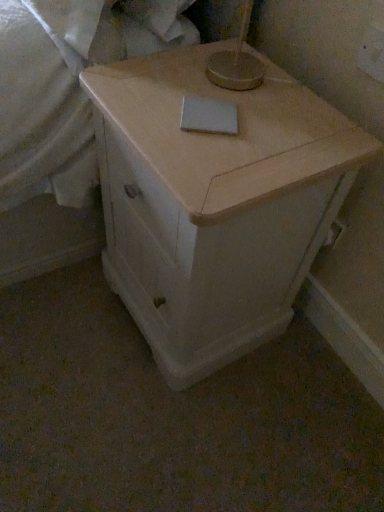
What do you see at coordinates (60, 90) in the screenshot? I see `white matte sheet at upper center` at bounding box center [60, 90].

What do you see at coordinates (209, 116) in the screenshot? I see `white matte notepad at center` at bounding box center [209, 116].

Identify the location of white matte sheet at upper center. (60, 90).

Between white matte sheet at upper center and white matte notepad at center, which one has less height?

Result: Standing shorter between the two is white matte notepad at center.

Identify the location of notepad behind the white matte sheet at upper center. Image resolution: width=384 pixels, height=512 pixels. (209, 116).

Is white matte sheet at upper center aimed at white matte notepad at center?

No, white matte sheet at upper center is not turned towards white matte notepad at center.

Which object is thinner, white matte sheet at upper center or white matte notepad at center?

With smaller width is white matte notepad at center.

Considering the points (214, 309) and (209, 115), which point is in front, point (214, 309) or point (209, 115)?

Positioned in front is point (209, 115).

Does light wood cabinet at center have a greater height compared to white matte notepad at center?

Indeed, light wood cabinet at center has a greater height compared to white matte notepad at center.

From the image's perspective, is light wood cabinet at center on white matte notepad at center?

No, from the image's perspective, light wood cabinet at center is not over white matte notepad at center.

Is light wood cabinet at center thinner than white matte notepad at center?

No.

In order to click on chest of drawers below the white matte sheet at upper center (from a real-world perspective) in this screenshot , I will do `click(215, 203)`.

Would you say light wood cabinet at center is a long distance from white matte sheet at upper center?

light wood cabinet at center is near white matte sheet at upper center, not far away.

Is light wood cabinet at center further to the viewer compared to white matte sheet at upper center?

That is False.

Can you tell me how much light wood cabinet at center and white matte sheet at upper center differ in facing direction?

1.41 degrees.

Does point (83, 65) appear closer or farther from the camera than point (213, 162)?

Point (83, 65) is positioned farther from the camera compared to point (213, 162).

Which of these two, white matte sheet at upper center or light wood cabinet at center, stands taller?

light wood cabinet at center is taller.

How many degrees apart are the facing directions of white matte sheet at upper center and light wood cabinet at center?

The angle between the facing direction of white matte sheet at upper center and the facing direction of light wood cabinet at center is 1.41 degrees.

Which is correct: white matte sheet at upper center is inside light wood cabinet at center, or outside of it?

white matte sheet at upper center is spatially situated outside light wood cabinet at center.

Is white matte sheet at upper center at the back of white matte notepad at center?

No.

Considering the relative sizes of white matte notepad at center and white matte sheet at upper center in the image provided, is white matte notepad at center bigger than white matte sheet at upper center?

Incorrect, white matte notepad at center is not larger than white matte sheet at upper center.

Identify the location of notepad above the white matte sheet at upper center (from a real-world perspective). (209, 116).

Can you tell me how much white matte notepad at center and white matte sheet at upper center differ in facing direction?

There is a 32.8-degree angle between the facing directions of white matte notepad at center and white matte sheet at upper center.

Is point (235, 121) positioned behind point (111, 242)?

No, (235, 121) is in front of (111, 242).

Between white matte notepad at center and light wood cabinet at center, which one appears on the left side from the viewer's perspective?

From the viewer's perspective, white matte notepad at center appears more on the left side.

Can you tell me how much white matte notepad at center and light wood cabinet at center differ in facing direction?

The angular difference between white matte notepad at center and light wood cabinet at center is 34.3 degrees.

Considering the sizes of white matte notepad at center and light wood cabinet at center in the image, is white matte notepad at center bigger or smaller than light wood cabinet at center?

white matte notepad at center is smaller than light wood cabinet at center.

I want to click on sheet that appears below the white matte notepad at center (from a real-world perspective), so click(60, 90).

The height and width of the screenshot is (512, 384). What are the coordinates of `notepad on the left of light wood cabinet at center` in the screenshot? It's located at pyautogui.click(x=209, y=116).

Looking at this image, considering their positions, is white matte notepad at center positioned further to white matte sheet at upper center than light wood cabinet at center?

Among the two, white matte notepad at center is located further to white matte sheet at upper center.

Looking at this image, from the image, which object appears to be nearer to white matte notepad at center, white matte sheet at upper center or light wood cabinet at center?

light wood cabinet at center is positioned closer to the anchor white matte notepad at center.

Looking at this image, which object lies further to the anchor point white matte sheet at upper center, light wood cabinet at center or white matte notepad at center?

white matte notepad at center lies further to white matte sheet at upper center than the other object.

Considering their positions, is white matte sheet at upper center positioned closer to light wood cabinet at center than white matte notepad at center?

white matte notepad at center.

Which object lies nearer to the anchor point light wood cabinet at center, white matte notepad at center or white matte sheet at upper center?

white matte notepad at center is closer to light wood cabinet at center.

From the image, which object appears to be farther from white matte notepad at center, light wood cabinet at center or white matte sheet at upper center?

The object further to white matte notepad at center is white matte sheet at upper center.

Where is `notepad between white matte sheet at upper center and light wood cabinet at center from top to bottom`? The height and width of the screenshot is (512, 384). notepad between white matte sheet at upper center and light wood cabinet at center from top to bottom is located at coordinates click(209, 116).